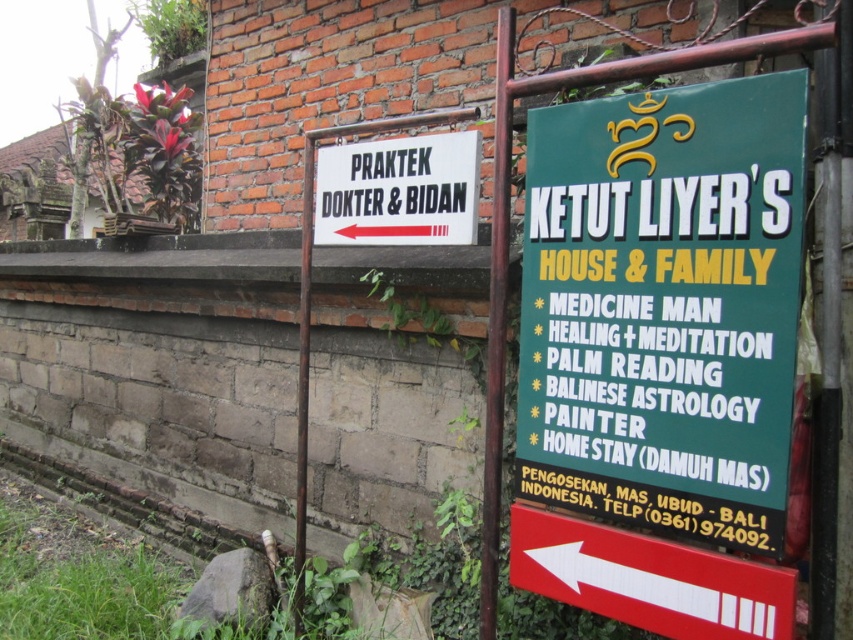
Is red arrow sign at left closer to the viewer compared to white paper sign at left?

Yes.

Does red arrow sign at left appear on the right side of white paper sign at left?

Correct, you'll find red arrow sign at left to the right of white paper sign at left.

You are a GUI agent. You are given a task and a screenshot of the screen. Output one action in this format:
    pyautogui.click(x=<x>, y=<y>)
    Task: Click on the red arrow sign at left
    This screenshot has height=640, width=853.
    Given the screenshot: What is the action you would take?
    pyautogui.click(x=648, y=579)

Can you confirm if green matte signboard at upper right is shorter than red arrow sign at left?

No.

Between point (556, 420) and point (664, 632), which one is positioned behind?

Positioned behind is point (556, 420).

Image resolution: width=853 pixels, height=640 pixels. I want to click on green matte signboard at upper right, so click(664, 307).

Based on the photo, can you confirm if green matte signboard at upper right is positioned to the left of white paper sign at left?

In fact, green matte signboard at upper right is to the right of white paper sign at left.

Can you confirm if green matte signboard at upper right is taller than white paper sign at left?

Correct, green matte signboard at upper right is much taller as white paper sign at left.

At what (x,y) coordinates should I click in order to perform the action: click on green matte signboard at upper right. Please return your answer as a coordinate pair (x, y). Looking at the image, I should click on (664, 307).